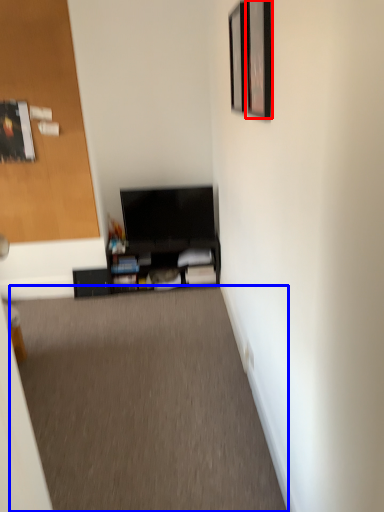
Question: Among these objects, which one is nearest to the camera, picture frame (highlighted by a red box) or plain (highlighted by a blue box)?

Choices:
 (A) picture frame
 (B) plain

Answer: (A)